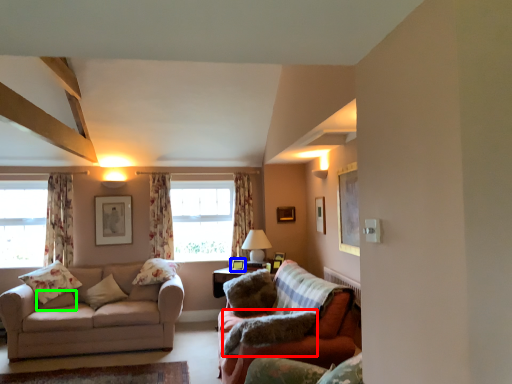
Question: Based on their relative distances, which object is farther from pillow (highlighted by a red box)? Choose from picture frame (highlighted by a blue box) and pillow (highlighted by a green box).

Choices:
 (A) picture frame
 (B) pillow

Answer: (B)